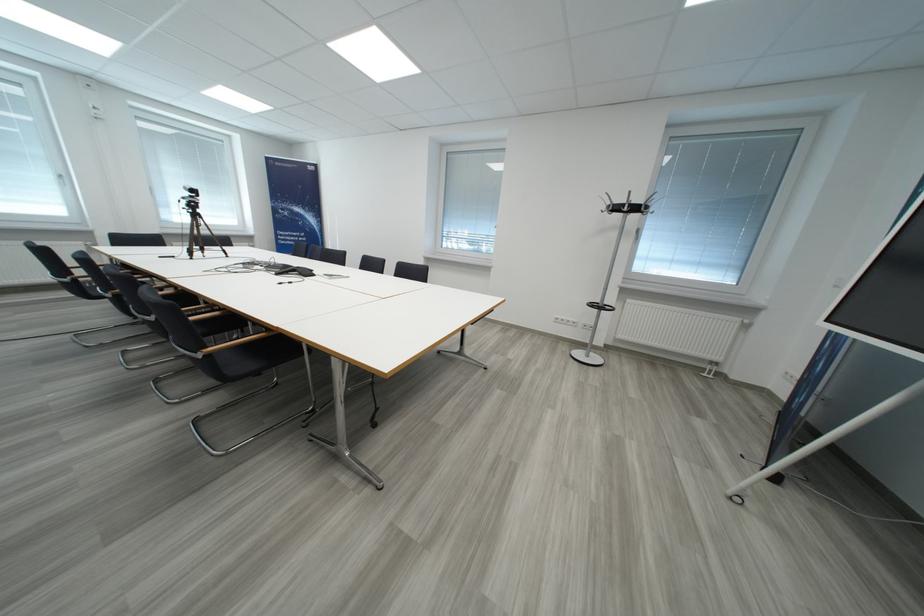
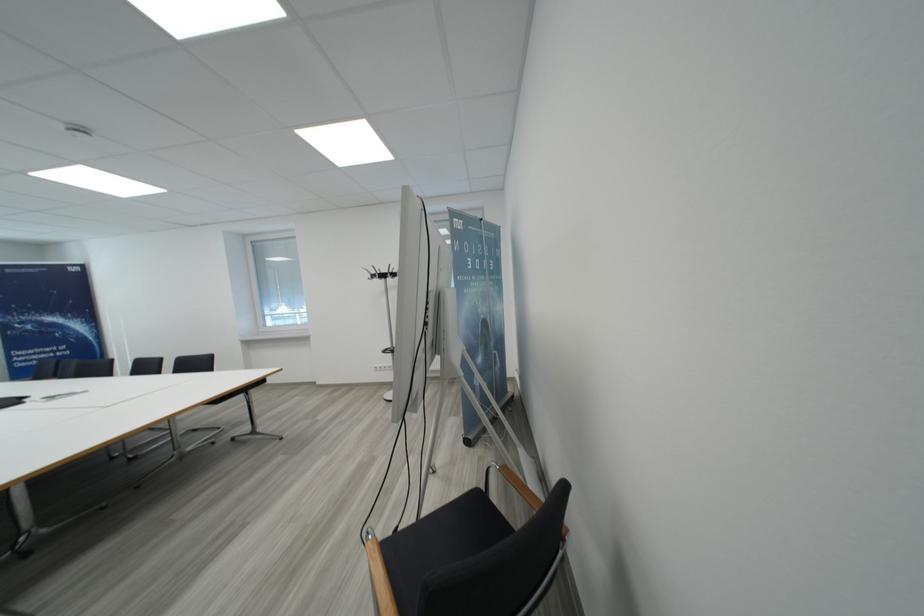
The point at (642, 211) is marked in the first image. Where is the corresponding point in the second image?

(390, 278)